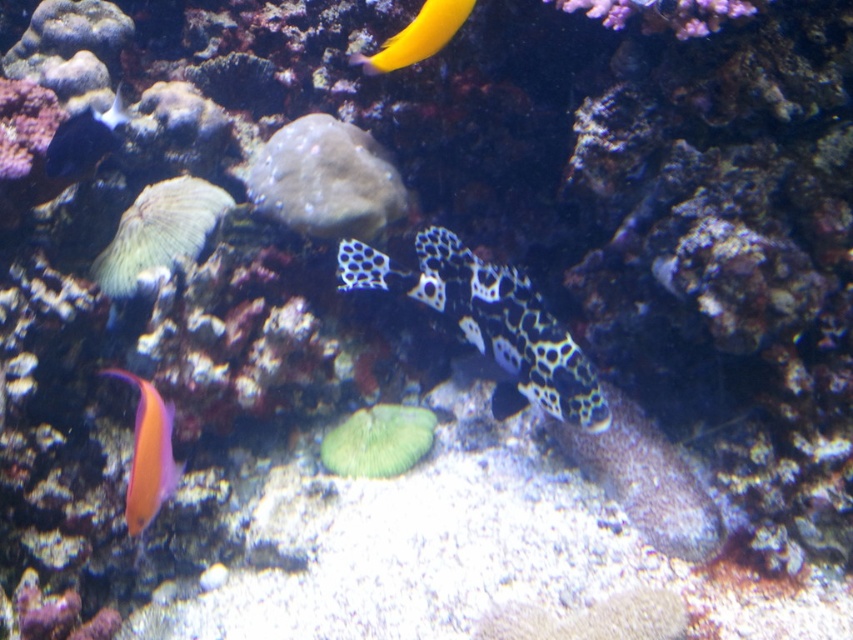
Question: Which point is closer to the camera?

Choices:
 (A) (497, 364)
 (B) (83, 131)

Answer: (B)

Question: Where is black and white spotted fish at center located in relation to shiny orange fish at lower left in the image?

Choices:
 (A) right
 (B) left

Answer: (A)

Question: Is black and white spotted fish at center to the left of shiny yellow fish at upper center from the viewer's perspective?

Choices:
 (A) no
 (B) yes

Answer: (A)

Question: Among these points, which one is nearest to the camera?

Choices:
 (A) (128, 378)
 (B) (393, 45)
 (C) (556, 371)

Answer: (B)

Question: Which is farther from the green coral at center?

Choices:
 (A) shiny yellow fish at upper center
 (B) shiny orange fish at lower left
 (C) black and white spotted fish at center

Answer: (A)

Question: From the image, what is the correct spatial relationship of black and white spotted fish at center in relation to shiny orange fish at lower left?

Choices:
 (A) left
 (B) right

Answer: (B)